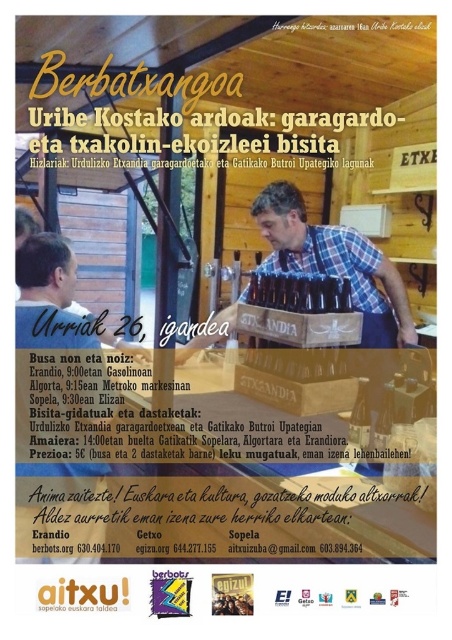
Between point (42, 272) and point (366, 419), which one is positioned in front?

Point (366, 419) is more forward.

Identify the location of plaid shirt at center. Image resolution: width=452 pixels, height=640 pixels. (48, 296).

Can you confirm if brown wooden crate at center is thinner than translucent glass bottle at center?

No, brown wooden crate at center is not thinner than translucent glass bottle at center.

Between brown wooden crate at center and translucent glass bottle at center, which one appears on the left side from the viewer's perspective?

brown wooden crate at center is more to the left.

What do you see at coordinates (334, 262) in the screenshot? I see `brown wooden crate at center` at bounding box center [334, 262].

Find the location of a particular element. brown wooden crate at center is located at coordinates click(x=334, y=262).

Can you confirm if brown wooden crate at center is positioned to the left of plaid shirt at center?

In fact, brown wooden crate at center is to the right of plaid shirt at center.

Is brown wooden crate at center shorter than plaid shirt at center?

In fact, brown wooden crate at center may be taller than plaid shirt at center.

This screenshot has height=640, width=452. I want to click on brown wooden crate at center, so 334,262.

This screenshot has height=640, width=452. In order to click on brown wooden crate at center in this screenshot , I will do `click(334, 262)`.